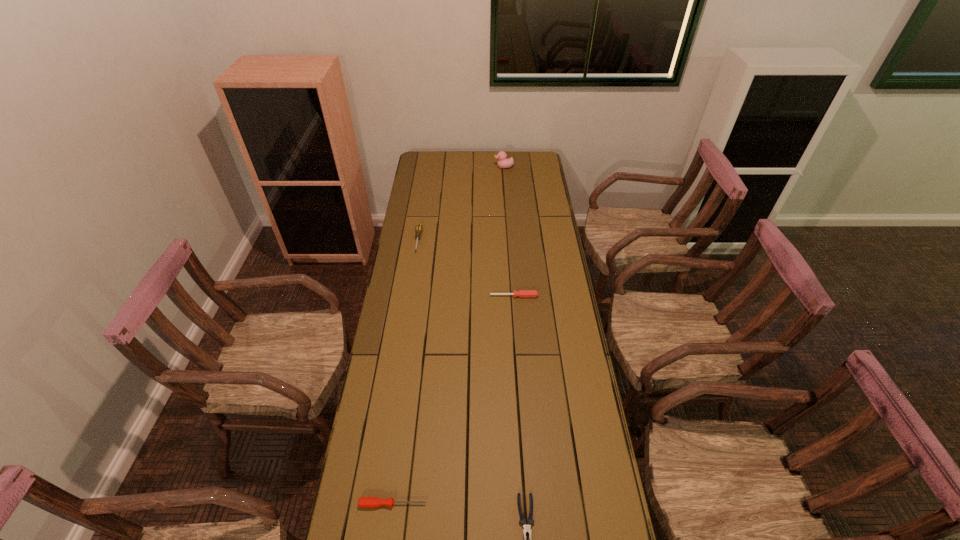
Identify the location of vacant space at the far right corner of the desktop. click(x=530, y=154).

The image size is (960, 540). In order to click on free space between the duckling and the third farthest object in this screenshot , I will do `click(509, 232)`.

I want to click on empty space between the second shortest object and the fourth nearest object, so click(x=405, y=372).

Locate an element on the screen. This screenshot has height=540, width=960. blank region between the duckling and the second shortest screwdriver is located at coordinates (509, 232).

At what (x,y) coordinates should I click in order to perform the action: click on empty space between the tallest object and the fourth tallest object. Please return your answer as a coordinate pair (x, y). Looking at the image, I should click on (448, 335).

Locate an element on the screen. This screenshot has width=960, height=540. vacant space in between the second tallest object and the fourth tallest object is located at coordinates (405, 372).

The image size is (960, 540). Identify the location of unoccupied area between the rightmost screwdriver and the nearest screwdriver. (453, 400).

Image resolution: width=960 pixels, height=540 pixels. What are the coordinates of `empty location between the tallest screwdriver and the tallest object` in the screenshot? It's located at (461, 204).

I want to click on object that stands as the second closest to the pliers, so click(522, 293).

Where is `object that is the closest to the shortest object`? This screenshot has width=960, height=540. object that is the closest to the shortest object is located at coordinates (364, 502).